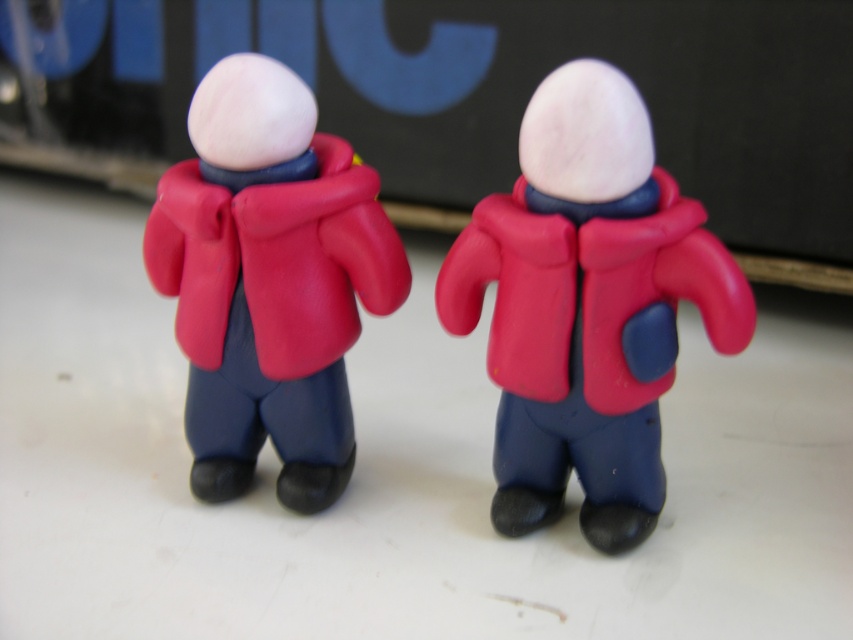
Does rubberized matte red jacket at center appear under rubberized matte red coat at center?

Indeed, rubberized matte red jacket at center is positioned under rubberized matte red coat at center.

Who is taller, rubberized matte red jacket at center or rubberized matte red coat at center?

rubberized matte red jacket at center

Find the location of a particular element. The image size is (853, 640). rubberized matte red jacket at center is located at coordinates (587, 307).